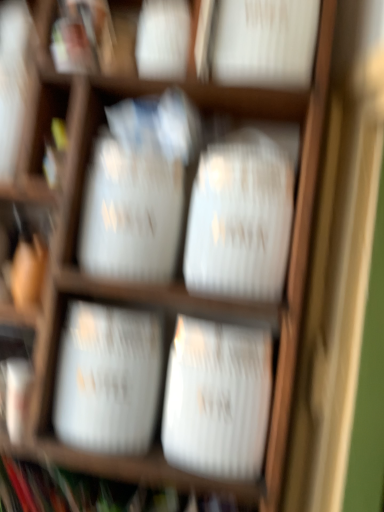
This screenshot has height=512, width=384. Identify the location of white glossy vase at center, which is the 2th wide from bottom to top. (108, 378).

The image size is (384, 512). What do you see at coordinates (217, 399) in the screenshot? I see `white glossy vase at center, which is the 3th wide in top-to-bottom order` at bounding box center [217, 399].

The height and width of the screenshot is (512, 384). Find the location of `white paper bag at center, the third wide from the bottom`. white paper bag at center, the third wide from the bottom is located at coordinates (240, 218).

From their relative heights in the image, would you say white paper bag at center, which ranks as the 1th wide in top-to-bottom order, is taller or shorter than white glossy vase at center, which ranks as the second wide in top-to-bottom order?

Considering their sizes, white paper bag at center, which ranks as the 1th wide in top-to-bottom order, has more height than white glossy vase at center, which ranks as the second wide in top-to-bottom order.

Considering the positions of objects white paper bag at center, which ranks as the 1th wide in top-to-bottom order, and white glossy vase at center, which ranks as the second wide in top-to-bottom order, in the image provided, who is more to the left, white paper bag at center, which ranks as the 1th wide in top-to-bottom order, or white glossy vase at center, which ranks as the second wide in top-to-bottom order,?

white glossy vase at center, which ranks as the second wide in top-to-bottom order.

Which of these two, white glossy vase at center, acting as the first wide starting from the bottom, or white paper bag at center, which ranks as the 1th wide in top-to-bottom order, is wider?

Wider between the two is white paper bag at center, which ranks as the 1th wide in top-to-bottom order.

Is white glossy vase at center, which is the 3th wide in top-to-bottom order, smaller than white paper bag at center, the third wide from the bottom?

Yes.

From a real-world perspective, which is physically below, white glossy vase at center, acting as the first wide starting from the bottom, or white paper bag at center, which ranks as the 1th wide in top-to-bottom order?

white glossy vase at center, acting as the first wide starting from the bottom, from a real-world perspective.

Does white paper bag at center, which ranks as the 1th wide in top-to-bottom order, appear on the left side of white glossy vase at center, acting as the first wide starting from the bottom?

In fact, white paper bag at center, which ranks as the 1th wide in top-to-bottom order, is to the right of white glossy vase at center, acting as the first wide starting from the bottom.

Which is behind, point (265, 180) or point (210, 359)?

The point (265, 180) is farther from the camera.

Who is taller, white paper bag at center, which ranks as the 1th wide in top-to-bottom order, or white glossy vase at center, which is the 3th wide in top-to-bottom order?

With more height is white paper bag at center, which ranks as the 1th wide in top-to-bottom order.

From the image's perspective, count 1st wides upward from the white glossy vase at center, acting as the first wide starting from the bottom, and point to it. Please provide its 2D coordinates.

[(108, 378)]

Is white glossy vase at center, acting as the first wide starting from the bottom, oriented towards white glossy vase at center, which is the 2th wide from bottom to top?

No, white glossy vase at center, acting as the first wide starting from the bottom, is not turned towards white glossy vase at center, which is the 2th wide from bottom to top.

Considering the positions of objects white glossy vase at center, which is the 3th wide in top-to-bottom order, and white glossy vase at center, which ranks as the second wide in top-to-bottom order, in the image provided, who is more to the left, white glossy vase at center, which is the 3th wide in top-to-bottom order, or white glossy vase at center, which ranks as the second wide in top-to-bottom order,?

From the viewer's perspective, white glossy vase at center, which ranks as the second wide in top-to-bottom order, appears more on the left side.

From a real-world perspective, is white glossy vase at center, acting as the first wide starting from the bottom, beneath white glossy vase at center, which is the 2th wide from bottom to top?

Incorrect, from a real-world perspective, white glossy vase at center, acting as the first wide starting from the bottom, is higher than white glossy vase at center, which is the 2th wide from bottom to top.

Considering the sizes of white glossy vase at center, which is the 2th wide from bottom to top, and white glossy vase at center, acting as the first wide starting from the bottom, in the image, is white glossy vase at center, which is the 2th wide from bottom to top, taller or shorter than white glossy vase at center, acting as the first wide starting from the bottom,?

Considering their sizes, white glossy vase at center, which is the 2th wide from bottom to top, has less height than white glossy vase at center, acting as the first wide starting from the bottom.

Consider the image. Is white glossy vase at center, which is the 2th wide from bottom to top, aimed at white glossy vase at center, acting as the first wide starting from the bottom?

No, white glossy vase at center, which is the 2th wide from bottom to top, is not turned towards white glossy vase at center, acting as the first wide starting from the bottom.

Does white glossy vase at center, which ranks as the second wide in top-to-bottom order, appear on the left side of white glossy vase at center, acting as the first wide starting from the bottom?

Indeed, white glossy vase at center, which ranks as the second wide in top-to-bottom order, is positioned on the left side of white glossy vase at center, acting as the first wide starting from the bottom.

Is white glossy vase at center, which ranks as the second wide in top-to-bottom order, shorter than white paper bag at center, which ranks as the 1th wide in top-to-bottom order?

Yes.

Which object is positioned more to the right, white glossy vase at center, which is the 2th wide from bottom to top, or white paper bag at center, the third wide from the bottom?

Positioned to the right is white paper bag at center, the third wide from the bottom.

Based on the photo, based on their sizes in the image, would you say white glossy vase at center, which is the 2th wide from bottom to top, is bigger or smaller than white paper bag at center, the third wide from the bottom?

white glossy vase at center, which is the 2th wide from bottom to top, is smaller than white paper bag at center, the third wide from the bottom.

Is white glossy vase at center, which ranks as the second wide in top-to-bottom order, situated inside white paper bag at center, which ranks as the 1th wide in top-to-bottom order, or outside?

white glossy vase at center, which ranks as the second wide in top-to-bottom order, is not enclosed by white paper bag at center, which ranks as the 1th wide in top-to-bottom order.

Image resolution: width=384 pixels, height=512 pixels. Find the location of `the 2nd wide counting from the left of the white paper bag at center, the third wide from the bottom`. the 2nd wide counting from the left of the white paper bag at center, the third wide from the bottom is located at coordinates (108, 378).

The height and width of the screenshot is (512, 384). I want to click on wide that is the 2nd object located below the white paper bag at center, which ranks as the 1th wide in top-to-bottom order (from the image's perspective), so click(x=217, y=399).

From the picture: Looking at the image, which one is located closer to white glossy vase at center, which is the 3th wide in top-to-bottom order, white paper bag at center, the third wide from the bottom, or white glossy vase at center, which is the 2th wide from bottom to top?

The object closer to white glossy vase at center, which is the 3th wide in top-to-bottom order, is white glossy vase at center, which is the 2th wide from bottom to top.

Which object lies nearer to the anchor point white paper bag at center, the third wide from the bottom, white glossy vase at center, acting as the first wide starting from the bottom, or white glossy vase at center, which ranks as the second wide in top-to-bottom order?

white glossy vase at center, acting as the first wide starting from the bottom, is closer to white paper bag at center, the third wide from the bottom.

Which object lies nearer to the anchor point white glossy vase at center, which ranks as the second wide in top-to-bottom order, white glossy vase at center, acting as the first wide starting from the bottom, or white paper bag at center, the third wide from the bottom?

white glossy vase at center, acting as the first wide starting from the bottom.

Based on their spatial positions, is white paper bag at center, the third wide from the bottom, or white glossy vase at center, acting as the first wide starting from the bottom, further from white glossy vase at center, which ranks as the second wide in top-to-bottom order?

white paper bag at center, the third wide from the bottom, is further to white glossy vase at center, which ranks as the second wide in top-to-bottom order.

Which object lies nearer to the anchor point white paper bag at center, which ranks as the 1th wide in top-to-bottom order, white glossy vase at center, which ranks as the second wide in top-to-bottom order, or white glossy vase at center, which is the 3th wide in top-to-bottom order?

white glossy vase at center, which is the 3th wide in top-to-bottom order.

From the image, which object appears to be farther from white glossy vase at center, which is the 3th wide in top-to-bottom order, white glossy vase at center, which is the 2th wide from bottom to top, or white paper bag at center, which ranks as the 1th wide in top-to-bottom order?

white paper bag at center, which ranks as the 1th wide in top-to-bottom order, is positioned further to the anchor white glossy vase at center, which is the 3th wide in top-to-bottom order.

Find the location of `wide between white paper bag at center, which ranks as the 1th wide in top-to-bottom order, and white glossy vase at center, which is the 3th wide in top-to-bottom order, in the vertical direction`. wide between white paper bag at center, which ranks as the 1th wide in top-to-bottom order, and white glossy vase at center, which is the 3th wide in top-to-bottom order, in the vertical direction is located at coordinates (108, 378).